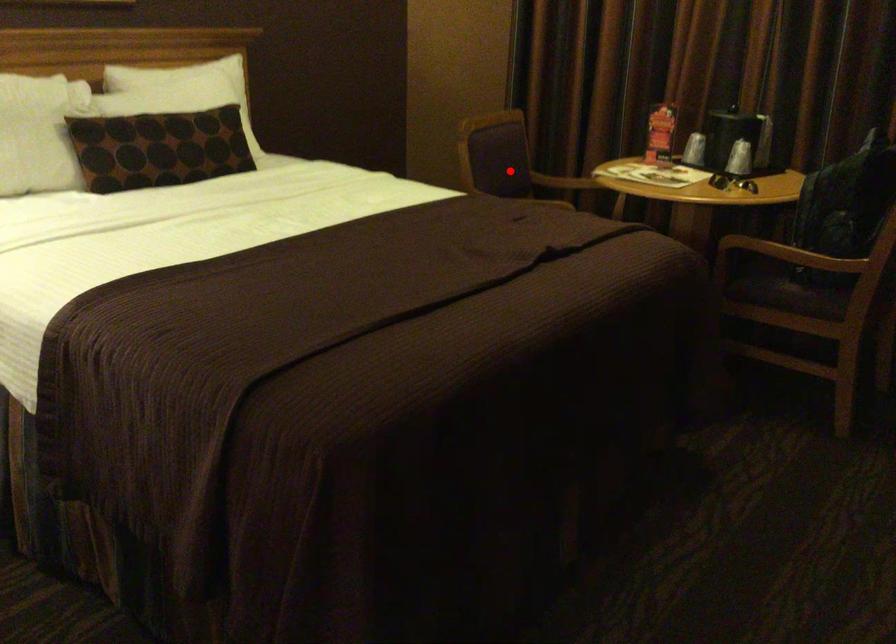
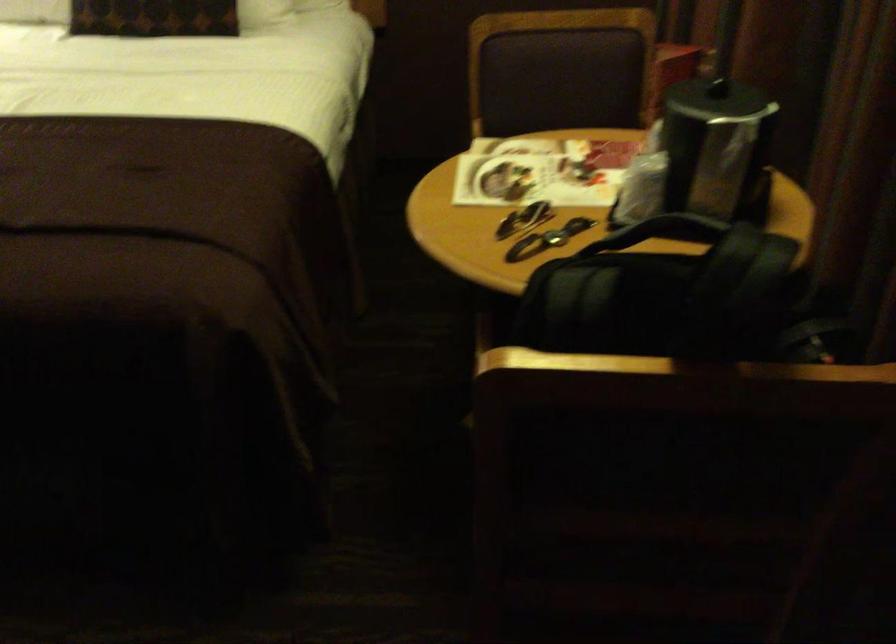
Question: I am providing you with two images of the same scene from different viewpoints. Image1 has a red point marked. In image2, the corresponding 3D location appears at what relative position? Reply with the corresponding letter.

Choices:
 (A) Closer
 (B) Farther

Answer: (A)